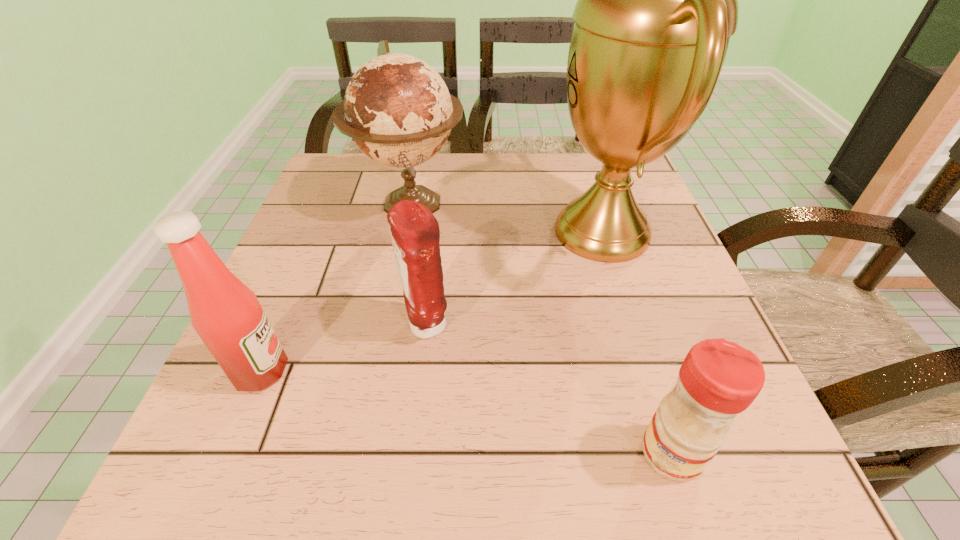
Where is `condiment present at the right edge`? The height and width of the screenshot is (540, 960). condiment present at the right edge is located at coordinates (718, 379).

I want to click on object that is positioned at the far left corner, so click(x=397, y=108).

Find the location of a particular element. The width and height of the screenshot is (960, 540). object that is at the far right corner is located at coordinates (657, 0).

Identify the location of object at the near right corner. (718, 379).

The height and width of the screenshot is (540, 960). In the image, there is a desktop. Identify the location of free space at the far edge. (429, 170).

Where is `vacant area at the near edge`? vacant area at the near edge is located at coordinates (467, 439).

Where is `vacant space at the left edge of the desktop`? This screenshot has height=540, width=960. vacant space at the left edge of the desktop is located at coordinates [x=324, y=341].

You are a GUI agent. You are given a task and a screenshot of the screen. Output one action in this format:
    pyautogui.click(x=<x>, y=<y>)
    Task: Click on the vacant space at the right edge of the desktop
    The image size is (960, 540).
    Given the screenshot: What is the action you would take?
    pyautogui.click(x=688, y=303)

At what (x,y) coordinates should I click in order to perform the action: click on vacant space at the far left corner of the desktop. Please return your answer as a coordinate pair (x, y). Image resolution: width=960 pixels, height=540 pixels. Looking at the image, I should click on (381, 183).

Locate an element on the screen. The width and height of the screenshot is (960, 540). vacant space at the far right corner is located at coordinates (579, 165).